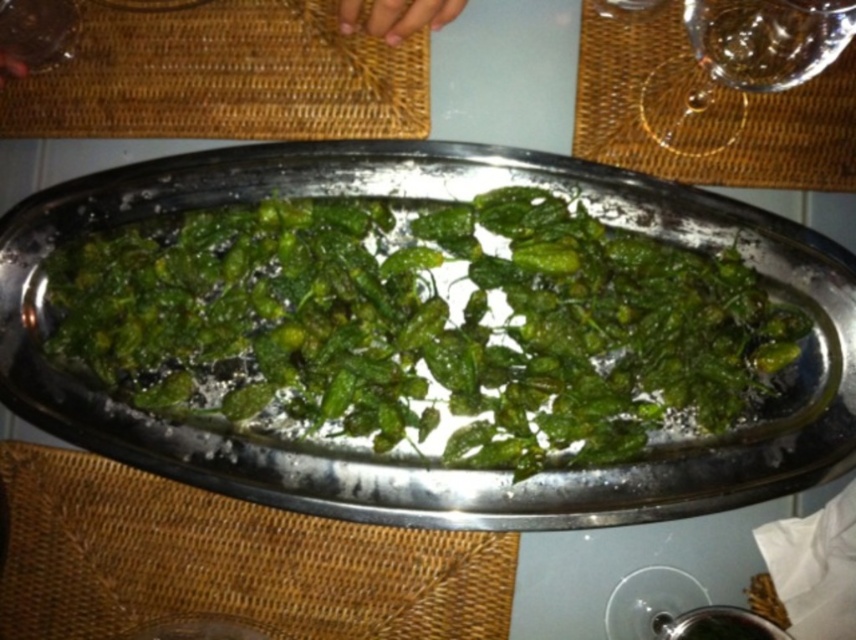
You are setting up a table for a dinner party and need to place the green leafy vegetable at center and the transparent glass at upper right. The minimum distance required between them is 10 inches for easy access. Based on the scene, can they be placed as specified?

The green leafy vegetable at center and transparent glass at upper right are 9.13 inches apart from each other, which is less than the required 10 inches. Therefore, they cannot be placed as specified.

You are standing at the point marked as point (x=217, y=272) in the image. You want to reach the edge of the metal tray without moving your feet. Can you do it?

The distance between you and the edge of the metal tray is 23.15 inches, so yes, you can reach it without moving your feet.

Based on the photo, you are setting up a table for a dinner party and need to place a tall centerpiece. You have a green leafy vegetable at center and a transparent glass at upper right. Which object should you choose to ensure it stands out as the tallest item on the table?

The green leafy vegetable at center is taller than the transparent glass at upper right, so you should choose the green leafy vegetable at center as the tallest item for the centerpiece.